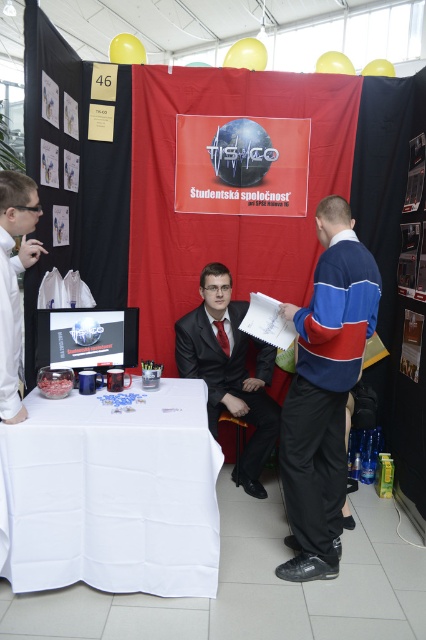
You are organizing a similar event and need to place a new banner between the matte plastic poster at center and the matte black suit at center. Which object should the new banner be placed closer to if it needs to be smaller than both?

The new banner should be placed closer to the matte plastic poster at center because it is smaller than the matte black suit at center, allowing the new banner to maintain its size relative to both objects.

You are a student attending the TIS CO event and want to find the white cloth table at lower left. Where should you look in the room?

The white cloth table at lower left is located at point (114, 492) in the room.